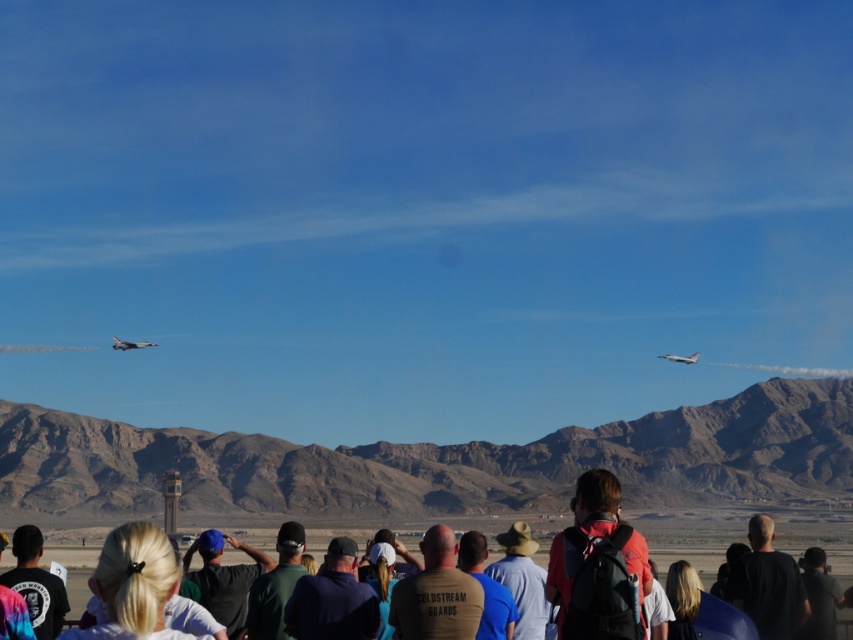
Question: Which point is closer to the camera taking this photo?

Choices:
 (A) (463, 582)
 (B) (762, 604)
 (C) (747, 504)
 (D) (184, 468)

Answer: (A)

Question: Estimate the real-world distances between objects in this image. Which object is farther from the desert brown rock formation at center?

Choices:
 (A) brown cotton shirt at center
 (B) black matte shirt at lower right
 (C) shiny silver jet at upper center

Answer: (A)

Question: Is dark brown shirt at center positioned at the back of brown cotton shirt at center?

Choices:
 (A) yes
 (B) no

Answer: (A)

Question: Which point is farther to the camera?

Choices:
 (A) brown cotton shirt at center
 (B) silver metallic jet at upper left

Answer: (B)

Question: Can you confirm if dark brown shirt at center is positioned above tie-dye shirt at lower left?

Choices:
 (A) no
 (B) yes

Answer: (A)

Question: Is brown cotton shirt at center below black matte shirt at lower right?

Choices:
 (A) no
 (B) yes

Answer: (A)